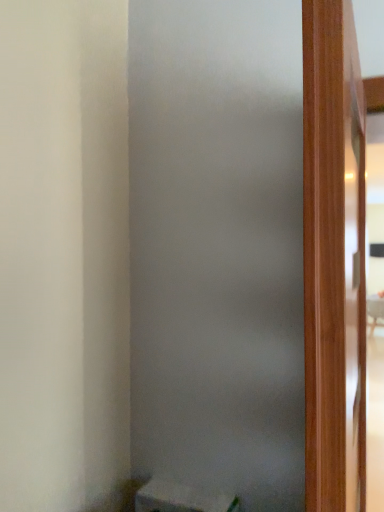
This screenshot has height=512, width=384. What do you see at coordinates (334, 259) in the screenshot? I see `wooden door at right` at bounding box center [334, 259].

This screenshot has height=512, width=384. I want to click on wooden door at right, so click(x=334, y=259).

Image resolution: width=384 pixels, height=512 pixels. What are the coordinates of `wooden door at right` in the screenshot? It's located at (334, 259).